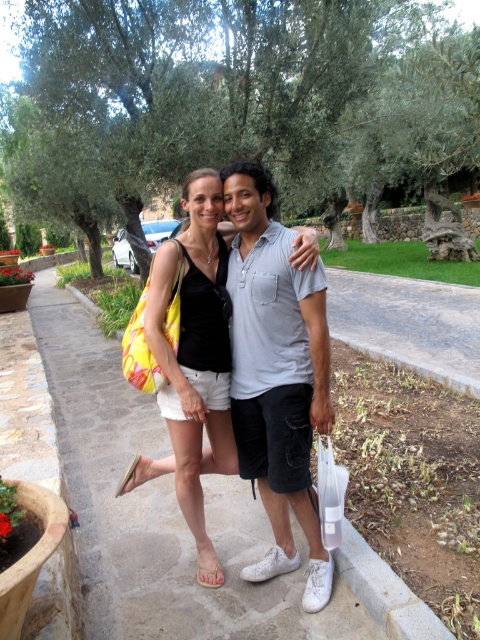
Question: Does matte black tank top at center appear under beige fabric sandal at lower center?

Choices:
 (A) no
 (B) yes

Answer: (A)

Question: Is light gray cotton shirt at center thinner than beige fabric sandal at lower center?

Choices:
 (A) no
 (B) yes

Answer: (A)

Question: Which point appears closest to the camera in this image?

Choices:
 (A) (217, 566)
 (B) (299, 499)

Answer: (B)

Question: Is light gray cotton shirt at center in front of matte black tank top at center?

Choices:
 (A) no
 (B) yes

Answer: (B)

Question: Which point appears farthest from the camera in this image?

Choices:
 (A) (300, 314)
 (B) (214, 566)
 (C) (217, 232)

Answer: (C)

Question: Which point appears closest to the camera in this image?

Choices:
 (A) (302, 365)
 (B) (192, 275)
 (C) (200, 564)

Answer: (A)